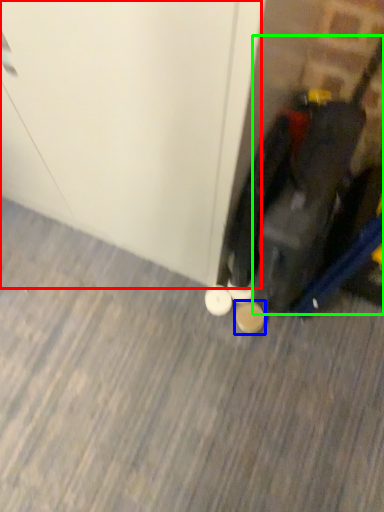
Question: Considering the real-world distances, which object is closest to door (highlighted by a red box)? footwear (highlighted by a blue box) or luggage (highlighted by a green box).

Choices:
 (A) footwear
 (B) luggage

Answer: (B)